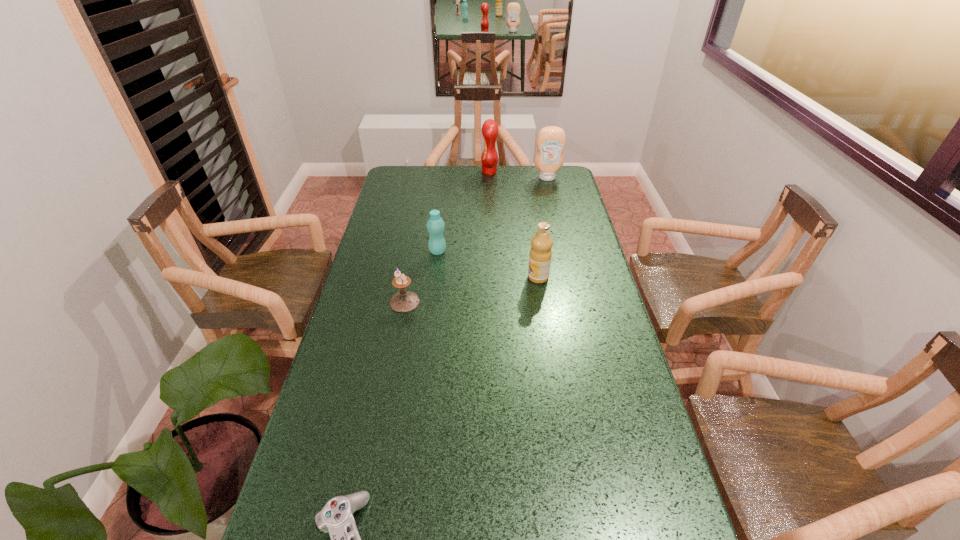
Identify which object is the closest to the fifth tallest object. Please provide its 2D coordinates. Your answer should be formatted as a tuple, i.e. [(x, y)], where the tuple contains the x and y coordinates of a point satisfying the conditions above.

[(435, 225)]

Find the location of a particular element. This screenshot has height=540, width=960. object identified as the second closest to the third farthest object is located at coordinates (540, 255).